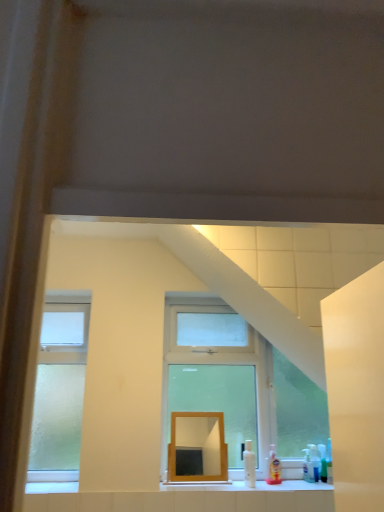
Question: Is point (213, 386) positioned closer to the camera than point (183, 422)?

Choices:
 (A) farther
 (B) closer

Answer: (A)

Question: Is clear glass window at center wider or thinner than wooden mirror at center?

Choices:
 (A) thin
 (B) wide

Answer: (B)

Question: Which object is positioned farthest from the wooden mirror at center?

Choices:
 (A) translucent plastic soap dispenser at lower right, positioned as the second toiletry in right-to-left order
 (B) translucent plastic spray bottle at lower right, arranged as the second toiletry when viewed from the left
 (C) clear glass window at center

Answer: (B)

Question: Which object is the closest to the translucent plastic soap dispenser at lower right, marked as the 1th toiletry in a left-to-right arrangement?

Choices:
 (A) translucent plastic spray bottle at lower right, arranged as the second toiletry when viewed from the left
 (B) clear glass window at center
 (C) wooden mirror at center

Answer: (A)